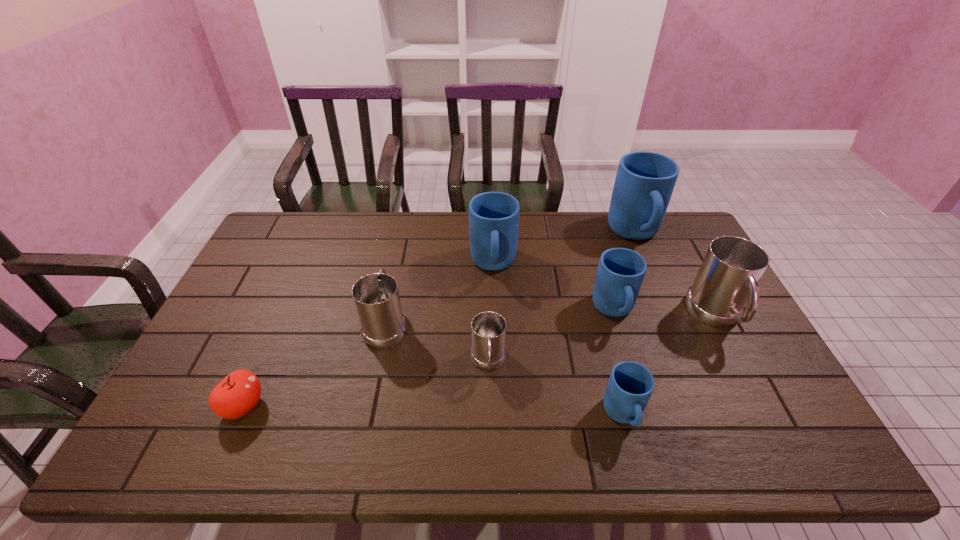
Choose which object is the fourth nearest neighbor to the second biggest blue mug. Please provide its 2D coordinates. Your answer should be formatted as a tuple, i.e. [(x, y)], where the tuple contains the x and y coordinates of a point satisfying the conditions above.

[(644, 183)]

Select which object is the closest to the leftmost object. Please provide its 2D coordinates. Your answer should be formatted as a tuple, i.e. [(x, y)], where the tuple contains the x and y coordinates of a point satisfying the conditions above.

[(376, 297)]

This screenshot has width=960, height=540. Identify the location of the sixth closest mug to the apple. (644, 183).

Select which mug is the sixth closest to the smallest blue mug. Please provide its 2D coordinates. Your answer should be formatted as a tuple, i.e. [(x, y)], where the tuple contains the x and y coordinates of a point satisfying the conditions above.

[(376, 297)]

Locate which blue mug is the third closest to the tallest mug. Please provide its 2D coordinates. Your answer should be formatted as a tuple, i.e. [(x, y)], where the tuple contains the x and y coordinates of a point satisfying the conditions above.

[(630, 385)]

Select which blue mug appears as the closest to the smallest blue mug. Please provide its 2D coordinates. Your answer should be formatted as a tuple, i.e. [(x, y)], where the tuple contains the x and y coordinates of a point satisfying the conditions above.

[(621, 271)]

Locate an element on the screen. The image size is (960, 540). the second closest gray mug to the leftmost gray mug is located at coordinates (728, 277).

Where is `gray mug that can be found as the second closest to the apple`? The image size is (960, 540). gray mug that can be found as the second closest to the apple is located at coordinates (488, 352).